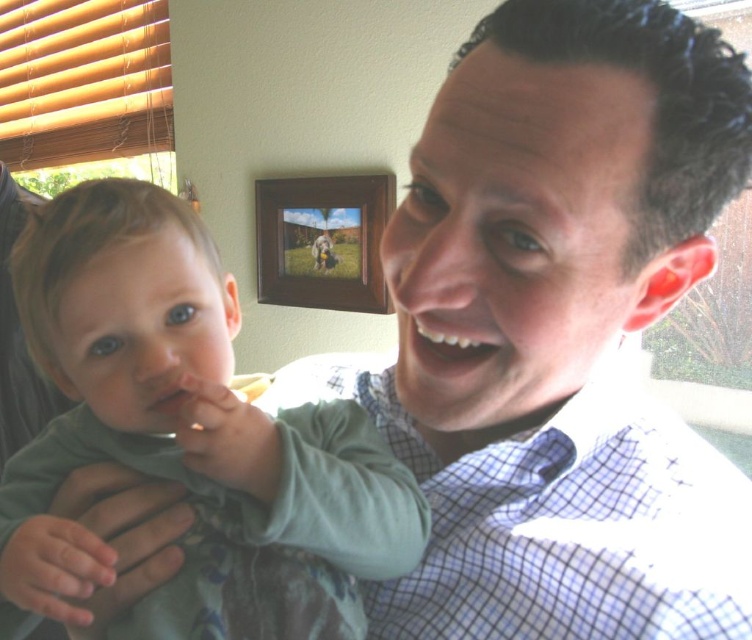
Question: Which point is farther to the camera?

Choices:
 (A) green cotton shirt at left
 (B) pink matte lips at center

Answer: (B)

Question: Can you confirm if blue checkered shirt at center is positioned above white glossy teeth at center?

Choices:
 (A) no
 (B) yes

Answer: (A)

Question: Can you confirm if blue checkered shirt at center is bigger than pink matte lips at center?

Choices:
 (A) no
 (B) yes

Answer: (B)

Question: Which point is closer to the camera?

Choices:
 (A) (744, 499)
 (B) (305, 237)
 (C) (159, 410)

Answer: (C)

Question: Which of these objects is positioned farthest from the green cotton shirt at left?

Choices:
 (A) white glossy teeth at center
 (B) blue checkered shirt at center
 (C) pink matte lips at center

Answer: (A)

Question: Is white glossy teeth at center positioned in front of pink matte lips at center?

Choices:
 (A) no
 (B) yes

Answer: (B)